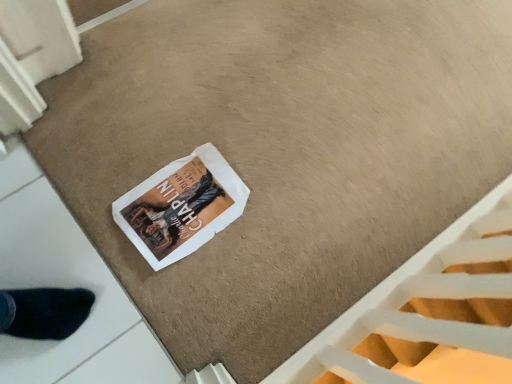
Question: Can you confirm if white paper magazine at center is positioned to the right of white textured stairwell at lower right?

Choices:
 (A) no
 (B) yes

Answer: (A)

Question: Does white paper magazine at center have a larger size compared to white textured stairwell at lower right?

Choices:
 (A) no
 (B) yes

Answer: (A)

Question: Is white textured stairwell at lower right surrounded by white paper magazine at center?

Choices:
 (A) yes
 (B) no

Answer: (B)

Question: Considering the relative positions of white paper magazine at center and white textured stairwell at lower right in the image provided, is white paper magazine at center in front of white textured stairwell at lower right?

Choices:
 (A) yes
 (B) no

Answer: (B)

Question: From the image's perspective, is white paper magazine at center below white textured stairwell at lower right?

Choices:
 (A) no
 (B) yes

Answer: (A)

Question: Are white paper magazine at center and white textured stairwell at lower right located far from each other?

Choices:
 (A) no
 (B) yes

Answer: (A)

Question: Can you confirm if white textured stairwell at lower right is smaller than white paper magazine at center?

Choices:
 (A) yes
 (B) no

Answer: (B)

Question: Does white textured stairwell at lower right contain white paper magazine at center?

Choices:
 (A) no
 (B) yes

Answer: (A)

Question: Can you confirm if white textured stairwell at lower right is bigger than white paper magazine at center?

Choices:
 (A) yes
 (B) no

Answer: (A)

Question: Is white textured stairwell at lower right shorter than white paper magazine at center?

Choices:
 (A) yes
 (B) no

Answer: (B)

Question: From a real-world perspective, is white textured stairwell at lower right under white paper magazine at center?

Choices:
 (A) yes
 (B) no

Answer: (B)

Question: Are white textured stairwell at lower right and white paper magazine at center making contact?

Choices:
 (A) yes
 (B) no

Answer: (B)

Question: Is white textured stairwell at lower right in front of or behind white paper magazine at center in the image?

Choices:
 (A) behind
 (B) front

Answer: (B)